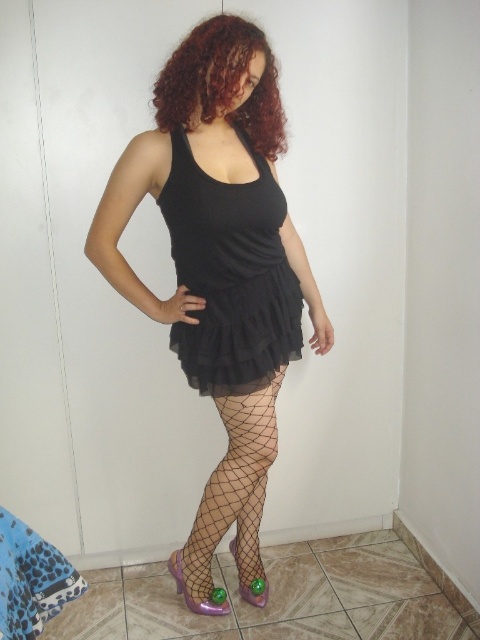
Looking at this image, which is above, matte black dress at center or shiny purple shoe at lower center?

matte black dress at center is higher up.

Does matte black dress at center have a greater height compared to shiny purple shoe at lower center?

Yes.

Is point (224, 275) positioned behind point (218, 604)?

No, (224, 275) is in front of (218, 604).

The height and width of the screenshot is (640, 480). What are the coordinates of `matte black dress at center` in the screenshot? It's located at (219, 262).

Is matte black dress at center taller than curly red hair at upper center?

Yes.

Between matte black dress at center and curly red hair at upper center, which one is positioned higher?

curly red hair at upper center is higher up.

Describe the element at coordinates (219, 262) in the screenshot. The image size is (480, 640). I see `matte black dress at center` at that location.

The image size is (480, 640). Find the location of `matte black dress at center`. matte black dress at center is located at coordinates (219, 262).

Is black sheer dress at center positioned at the back of curly red hair at upper center?

Yes, it is.

Is black sheer dress at center wider than curly red hair at upper center?

Yes, black sheer dress at center is wider than curly red hair at upper center.

Image resolution: width=480 pixels, height=640 pixels. What are the coordinates of `black sheer dress at center` in the screenshot? It's located at (230, 275).